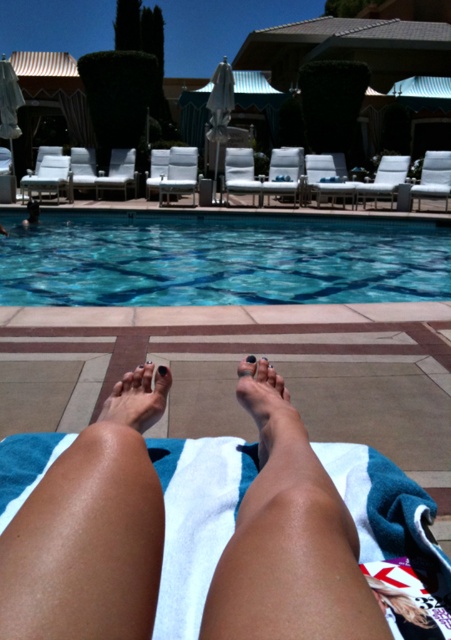
Question: Which of these objects is positioned farthest from the black nail polish at center?

Choices:
 (A) nail polish matte foot at lower center
 (B) blue glassy water at center

Answer: (B)

Question: Does nail polish painted toenail at center have a lesser width compared to black nail polish at center?

Choices:
 (A) no
 (B) yes

Answer: (A)

Question: Is nail polish painted toenail at center positioned in front of matte black toe at center?

Choices:
 (A) no
 (B) yes

Answer: (B)

Question: Estimate the real-world distances between objects in this image. Which object is closer to the nail polish matte foot at lower center?

Choices:
 (A) blue glassy water at center
 (B) black nail polish at center
 (C) nail polish painted toenail at center
 (D) matte black toe at center

Answer: (C)

Question: Which point is farther from the camera taking this photo?

Choices:
 (A) (159, 368)
 (B) (271, 461)
 (C) (368, 237)

Answer: (C)

Question: From the image, what is the correct spatial relationship of black nail polish at center in relation to matte black toe at center?

Choices:
 (A) right
 (B) left

Answer: (B)